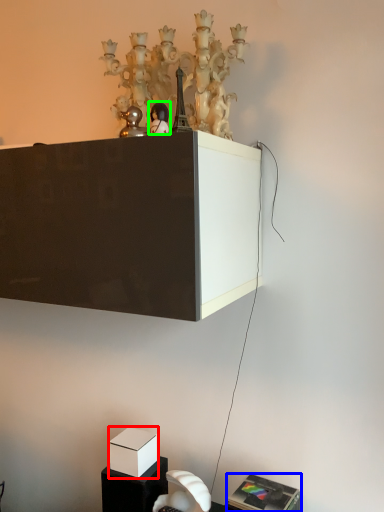
Question: Which object is positioned closest to box (highlighted by a red box)? Select from furniture (highlighted by a blue box) and toy (highlighted by a green box).

Choices:
 (A) furniture
 (B) toy

Answer: (A)